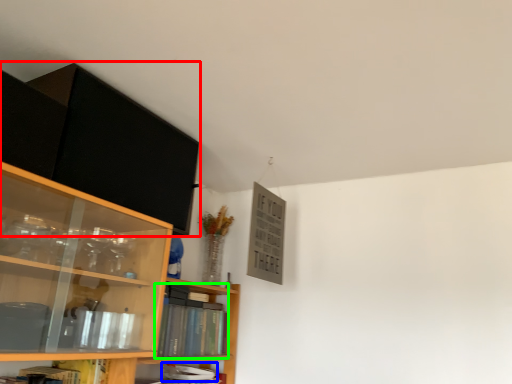
Question: Estimate the real-world distances between objects in this image. Which object is farther from cabinetry (highlighted by a red box), book (highlighted by a blue box) or book (highlighted by a green box)?

Choices:
 (A) book
 (B) book

Answer: (A)